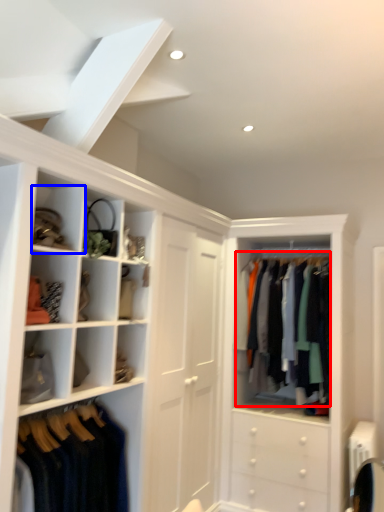
Question: Which object is further to the camera taking this photo, clothing (highlighted by a red box) or cabinet (highlighted by a blue box)?

Choices:
 (A) clothing
 (B) cabinet

Answer: (A)